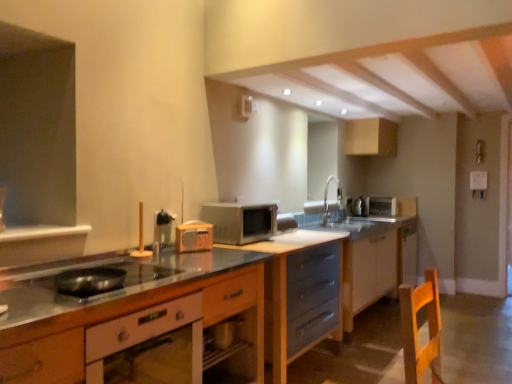
Question: Is silver metallic faucet at upper center far from matte gray drawers at center, positioned as the 2th cabinetry in front-to-back order?

Choices:
 (A) yes
 (B) no

Answer: (B)

Question: Is silver metallic faucet at upper center closer to the viewer compared to matte gray drawers at center, the 4th cabinetry in the back-to-front sequence?

Choices:
 (A) yes
 (B) no

Answer: (B)

Question: Is the depth of silver metallic faucet at upper center greater than that of matte gray drawers at center, positioned as the 2th cabinetry in front-to-back order?

Choices:
 (A) yes
 (B) no

Answer: (A)

Question: Is silver metallic faucet at upper center with matte gray drawers at center, positioned as the 2th cabinetry in front-to-back order?

Choices:
 (A) no
 (B) yes

Answer: (A)

Question: From a real-world perspective, is silver metallic faucet at upper center positioned over matte gray drawers at center, the 4th cabinetry in the back-to-front sequence, based on gravity?

Choices:
 (A) yes
 (B) no

Answer: (A)

Question: From a real-world perspective, is silver metallic faucet at upper center below matte gray drawers at center, the 4th cabinetry in the back-to-front sequence?

Choices:
 (A) no
 (B) yes

Answer: (A)

Question: Is satin silver toaster at upper center, the second appliance positioned from the back, next to silver metallic faucet at upper center?

Choices:
 (A) yes
 (B) no

Answer: (B)

Question: From the image's perspective, is satin silver toaster at upper center, the second appliance viewed from the right, located beneath silver metallic faucet at upper center?

Choices:
 (A) yes
 (B) no

Answer: (A)

Question: Does satin silver toaster at upper center, the 2th appliance viewed from the left, come behind silver metallic faucet at upper center?

Choices:
 (A) no
 (B) yes

Answer: (B)

Question: Is satin silver toaster at upper center, the second appliance viewed from the right, positioned before silver metallic faucet at upper center?

Choices:
 (A) no
 (B) yes

Answer: (A)

Question: Would you say silver metallic faucet at upper center is part of satin silver toaster at upper center, marked as the 2th appliance in a front-to-back arrangement,'s contents?

Choices:
 (A) no
 (B) yes

Answer: (A)

Question: Is matte gray drawers at center, which is the third cabinetry from front to back, completely or partially outside of white glossy cabinet at lower right, which is the 4th cabinetry in front-to-back order?

Choices:
 (A) no
 (B) yes

Answer: (B)